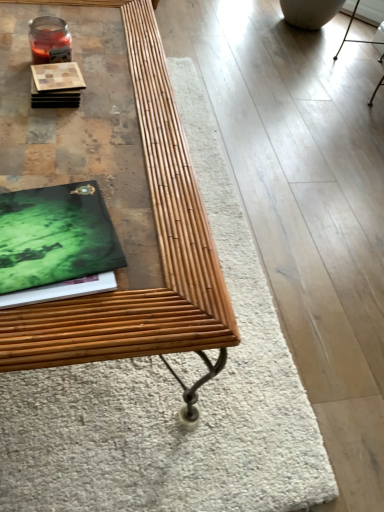
Where is `free spot above bamboo table at center (from a real-world perspective)`? This screenshot has width=384, height=512. free spot above bamboo table at center (from a real-world perspective) is located at coordinates (89, 125).